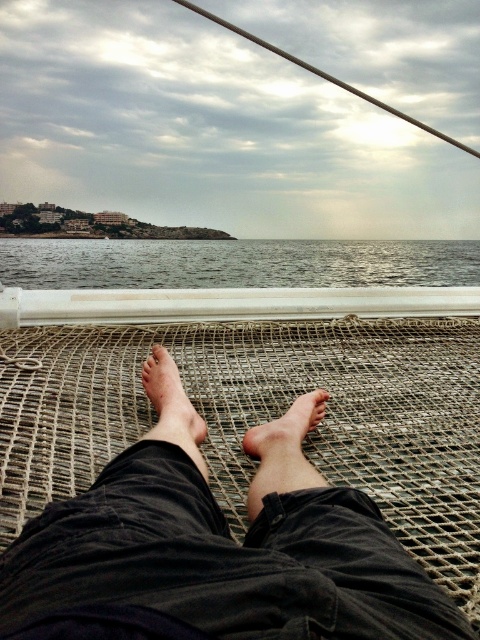
You are a person sitting on the boat deck. You see the gray water at center and the dry skin at center. Which one is higher from the ground?

The gray water at center is taller than dry skin at center, so the gray water at center is higher from the ground.

From the picture: You are standing at the point marked as point [216,561] on the boat deck. Which direction should you move to reach the dark fabric legs at center?

The dark fabric legs at center are located at point [216,561], so you are already at the same location as the dark fabric legs at center.

You are standing on the boat deck and want to reach the point marked at coordinates (279, 547). If your arm can extend 30 inches, will you be able to reach it?

The point marked at coordinates (279, 547) is 34.76 inches away from your current position, which is beyond the 30 inches reach of your arm. Therefore, you cannot reach it with your arm.